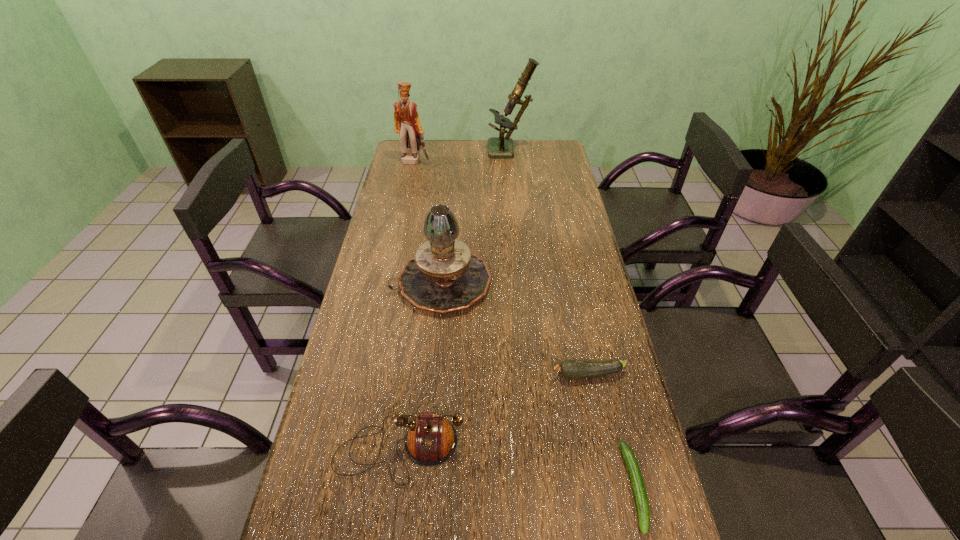
The image size is (960, 540). I want to click on free area in between the oil lamp and the shorter zucchini, so click(539, 385).

Where is `empty space between the microscope and the nutcracker`? empty space between the microscope and the nutcracker is located at coordinates (463, 157).

The height and width of the screenshot is (540, 960). Identify the location of free area in between the third shortest object and the taller zucchini. (494, 412).

You are a GUI agent. You are given a task and a screenshot of the screen. Output one action in this format:
    pyautogui.click(x=<x>, y=<y>)
    Task: Click on the free spot between the farther zucchini and the oil lamp
    The width and height of the screenshot is (960, 540).
    Given the screenshot: What is the action you would take?
    pyautogui.click(x=515, y=329)

In order to click on free space between the shortest object and the microscope in this screenshot , I will do click(572, 320).

Locate an element on the screen. Image resolution: width=960 pixels, height=540 pixels. vacant point located between the oil lamp and the taller zucchini is located at coordinates (515, 329).

At what (x,y) coordinates should I click in order to perform the action: click on vacant region between the fourth nearest object and the taller zucchini. Please return your answer as a coordinate pair (x, y). The height and width of the screenshot is (540, 960). Looking at the image, I should click on tap(515, 329).

Where is `vacant space that is in between the telephone and the nearer zucchini`? This screenshot has height=540, width=960. vacant space that is in between the telephone and the nearer zucchini is located at coordinates (517, 468).

Locate an element on the screen. This screenshot has height=540, width=960. object identified as the fourth closest to the fourth nearest object is located at coordinates (407, 124).

Locate an element on the screen. The image size is (960, 540). object that can be found as the closest to the fourth shortest object is located at coordinates [x=571, y=369].